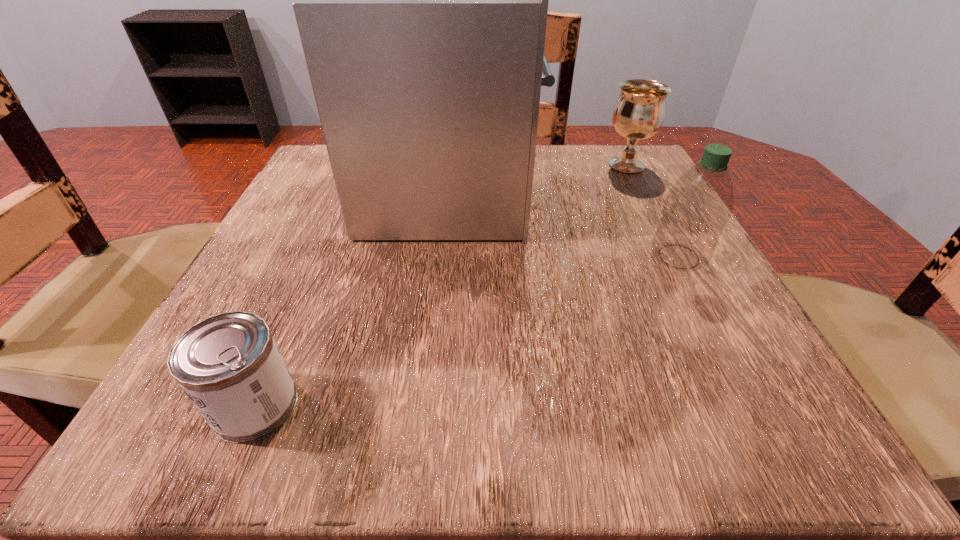
Identify the location of blank space at the left edge. (316, 344).

At what (x,y) coordinates should I click in order to perform the action: click on free space at the right edge. Please return your answer as a coordinate pair (x, y). The image size is (960, 540). Looking at the image, I should click on pos(631,285).

Image resolution: width=960 pixels, height=540 pixels. What are the coordinates of `free space at the far left corner of the desktop` in the screenshot? It's located at (297, 196).

At what (x,y) coordinates should I click in order to perform the action: click on blank area at the far right corner. Please return your answer as a coordinate pair (x, y). The image size is (960, 540). Looking at the image, I should click on (612, 177).

Where is `free space at the near right corner`? The image size is (960, 540). free space at the near right corner is located at coordinates (728, 387).

At what (x,y) coordinates should I click in order to perform the action: click on free space between the can and the water bottle. Please return your answer as a coordinate pair (x, y). Looking at the image, I should click on (468, 331).

Identify the location of unoccupied area between the can and the toaster oven. (353, 296).

Locate an element on the screen. free space between the chalice and the water bottle is located at coordinates (653, 211).

In order to click on free space between the toaster oven and the nearest object in this screenshot , I will do `click(353, 296)`.

The image size is (960, 540). I want to click on blank region between the water bottle and the chalice, so click(653, 211).